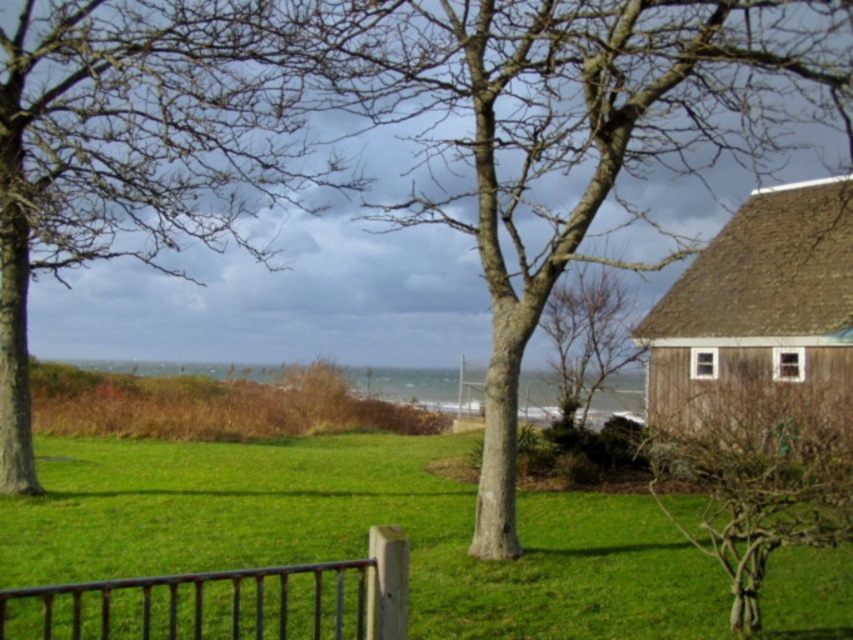
Question: Observing the image, what is the correct spatial positioning of smooth bark tree at left in reference to bare wood tree at center?

Choices:
 (A) right
 (B) left

Answer: (B)

Question: Does brown wooden hut at right lie in front of rusty metal fence at lower center?

Choices:
 (A) yes
 (B) no

Answer: (B)

Question: Does smooth bark tree at left come behind brown wooden hut at right?

Choices:
 (A) no
 (B) yes

Answer: (B)

Question: Considering the real-world distances, which object is closest to the smooth bark tree at left?

Choices:
 (A) brown wooden hut at right
 (B) bare wood tree at right

Answer: (B)

Question: Among these objects, which one is farthest from the camera?

Choices:
 (A) rusty metal fence at lower center
 (B) bare wood tree at right
 (C) bare wood tree at center
 (D) green grass at center

Answer: (C)

Question: Among these objects, which one is farthest from the camera?

Choices:
 (A) smooth bark tree at left
 (B) bare wood tree at right
 (C) rusty metal fence at lower center

Answer: (A)